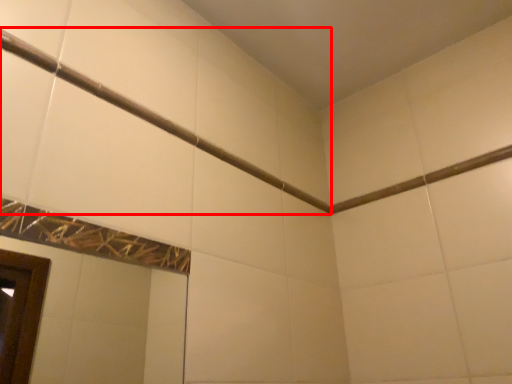
Question: From the image's perspective, what is the correct spatial relationship of shower (annotated by the red box) in relation to beam?

Choices:
 (A) below
 (B) above

Answer: (B)